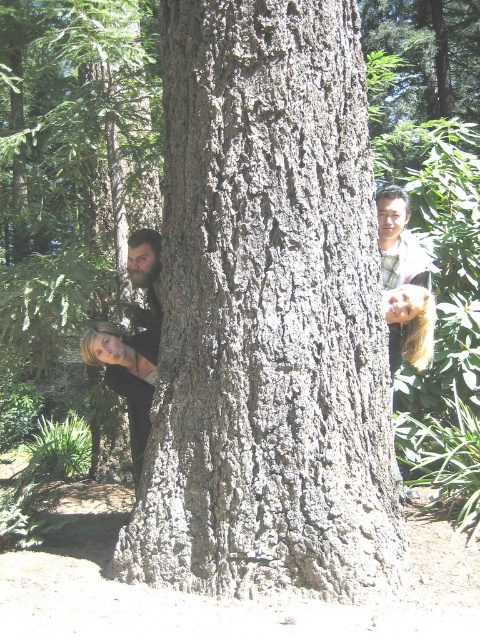
Question: Which point is closer to the camera taking this photo?

Choices:
 (A) (419, 253)
 (B) (393, 522)

Answer: (B)

Question: Which of the following is the farthest from the observer?

Choices:
 (A) (422, 260)
 (B) (179, 564)
 (C) (157, 314)

Answer: (A)

Question: Is gray rough bark at center to the right of bearded man at left from the viewer's perspective?

Choices:
 (A) yes
 (B) no

Answer: (A)

Question: Which of the following is the farthest from the observer?

Choices:
 (A) (128, 312)
 (B) (276, 349)

Answer: (A)

Question: Does gray rough bark at center have a larger size compared to bearded man at left?

Choices:
 (A) yes
 (B) no

Answer: (A)

Question: Considering the relative positions of gray rough bark at center and bearded man at left in the image provided, where is gray rough bark at center located with respect to bearded man at left?

Choices:
 (A) right
 (B) left

Answer: (A)